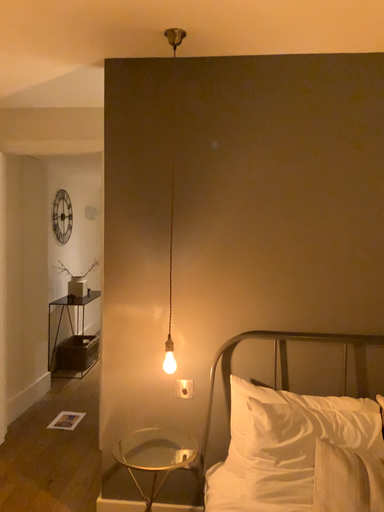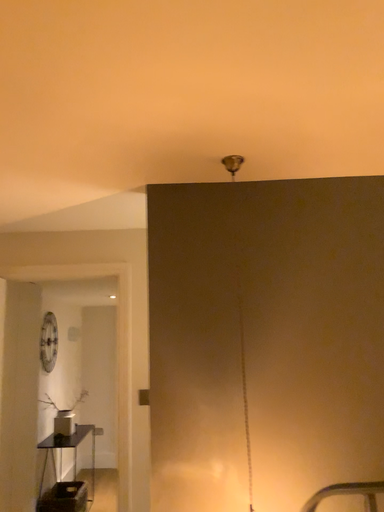
Question: How did the camera likely rotate when shooting the video?

Choices:
 (A) rotated upward
 (B) rotated downward

Answer: (A)